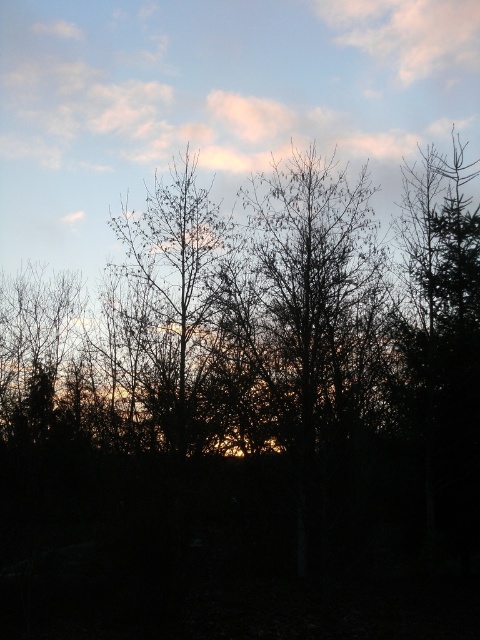
Is point (206, 355) farther from camera compared to point (442, 26)?

No, it is in front of (442, 26).

Can you confirm if bare branches at center is taller than pink cotton cloud at upper center?

Indeed, bare branches at center has a greater height compared to pink cotton cloud at upper center.

Measure the distance between point (152,410) and camera.

A distance of 12.78 meters exists between point (152,410) and camera.

Find the location of a particular element. Image resolution: width=480 pixels, height=640 pixels. bare branches at center is located at coordinates (178, 285).